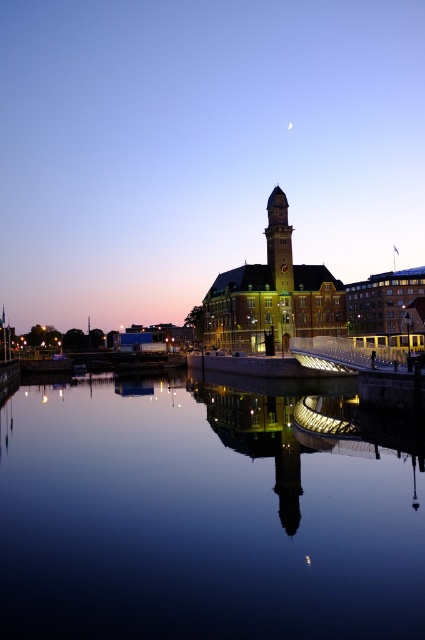
Question: Does smooth glass water at center appear under golden stone clock tower at center?

Choices:
 (A) yes
 (B) no

Answer: (A)

Question: Which point is closer to the camera?

Choices:
 (A) golden stone clock tower at center
 (B) smooth glass water at center

Answer: (B)

Question: Estimate the real-world distances between objects in this image. Which object is closer to the golden brick tower at center?

Choices:
 (A) golden stone clock tower at center
 (B) smooth glass water at center

Answer: (A)

Question: Which of the following is the closest to the observer?

Choices:
 (A) (241, 508)
 (B) (283, 196)

Answer: (A)

Question: Does smooth glass water at center have a smaller size compared to golden stone clock tower at center?

Choices:
 (A) no
 (B) yes

Answer: (A)

Question: Considering the relative positions of smooth glass water at center and golden brick tower at center in the image provided, where is smooth glass water at center located with respect to golden brick tower at center?

Choices:
 (A) right
 (B) left

Answer: (B)